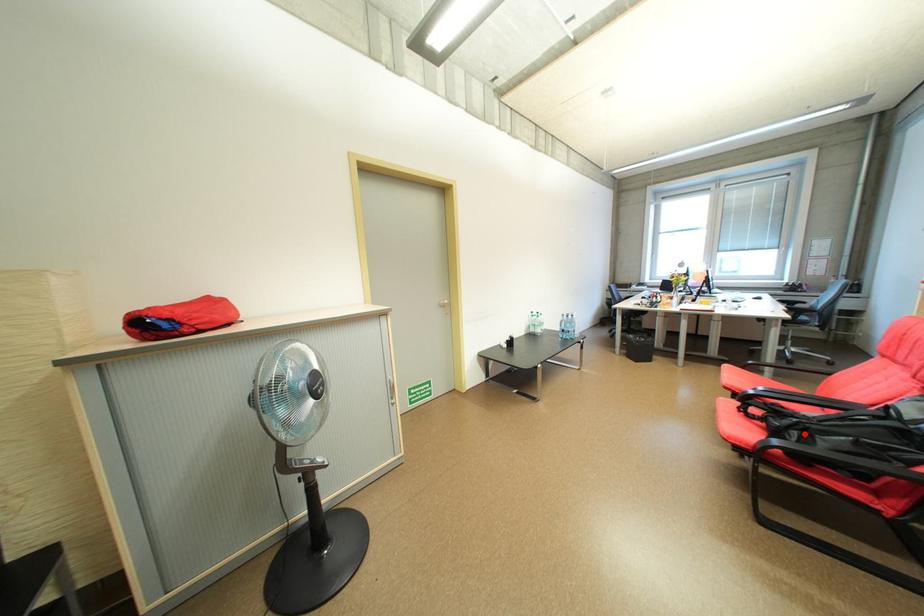
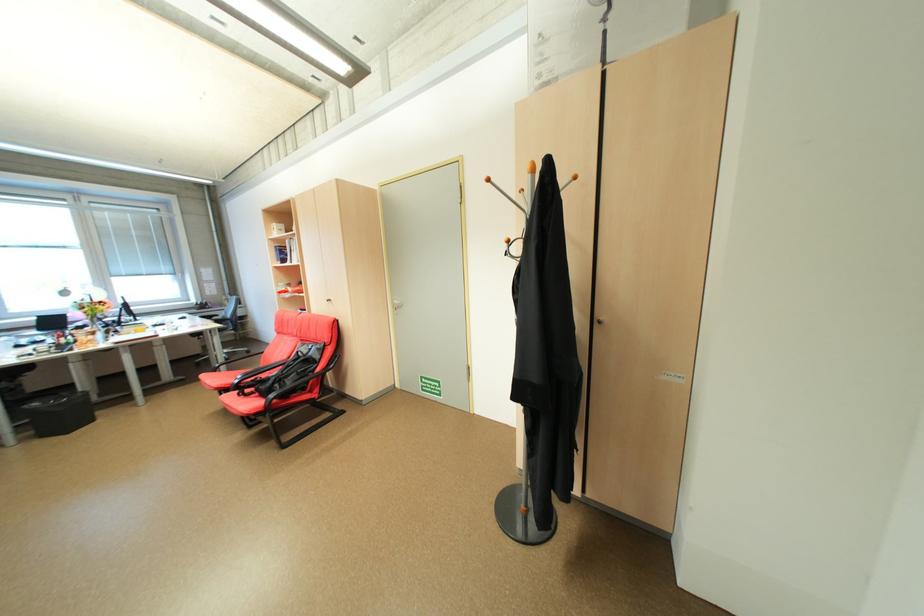
Where in the second image is the point corresponding to the highlighted location from the first image?

(286, 386)